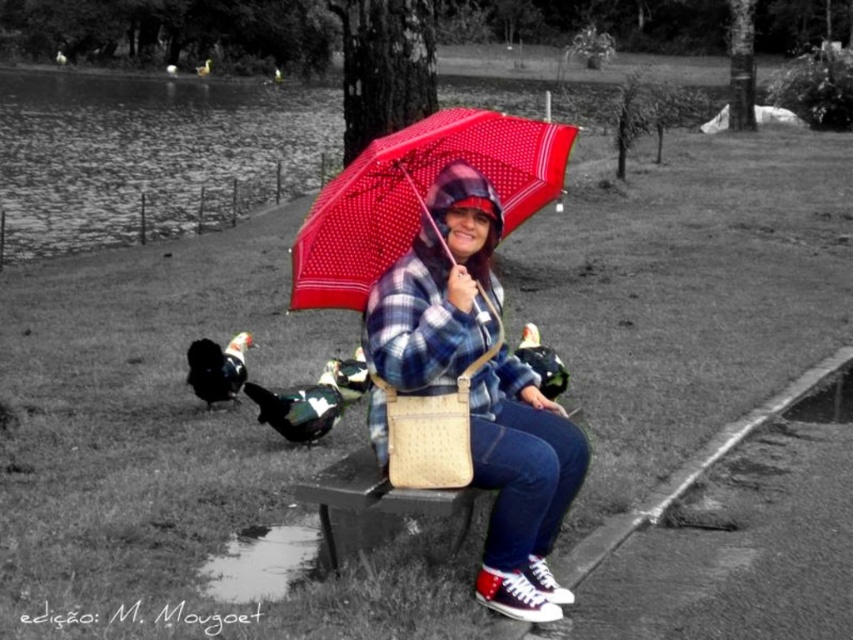
Does matte plaid jacket at center appear on the left side of polka dot fabric umbrella at center?

Correct, you'll find matte plaid jacket at center to the left of polka dot fabric umbrella at center.

Locate an element on the screen. matte plaid jacket at center is located at coordinates (434, 298).

You are a GUI agent. You are given a task and a screenshot of the screen. Output one action in this format:
    pyautogui.click(x=<x>, y=<y>)
    Task: Click on the matte plaid jacket at center
    The image size is (853, 640).
    Given the screenshot: What is the action you would take?
    pyautogui.click(x=434, y=298)